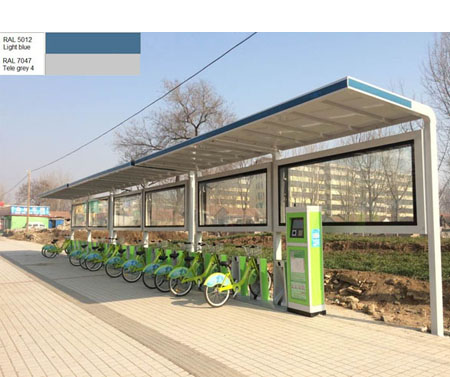
I want to click on support poles, so click(432, 203), click(275, 243), click(194, 237), click(145, 235), click(112, 233), click(89, 232), click(73, 232).